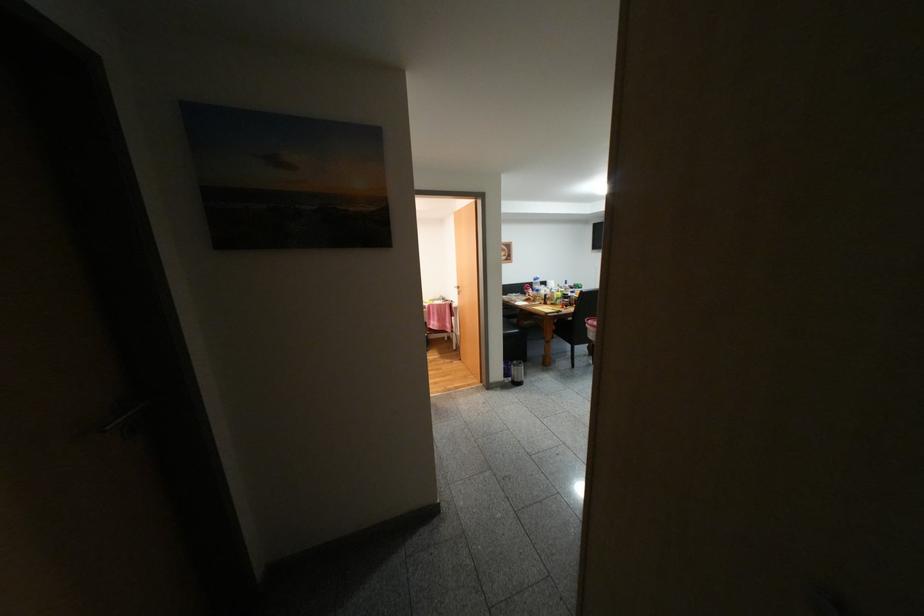
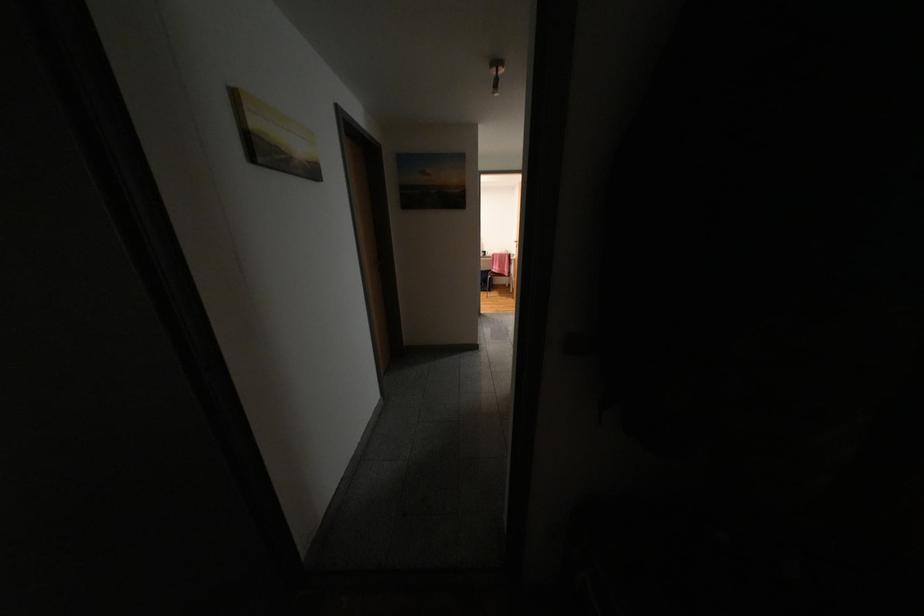
In a continuous first-person perspective shot, in which direction is the camera moving?

The movement direction of the cameraman is right, backward.